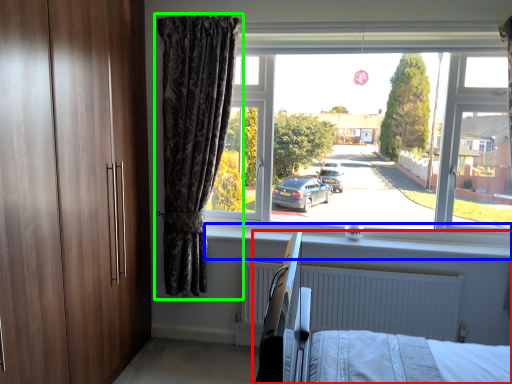
Question: Which is farther away from hospital bed (highlighted by a red box)? window sill (highlighted by a blue box) or curtain (highlighted by a green box)?

Choices:
 (A) window sill
 (B) curtain

Answer: (B)